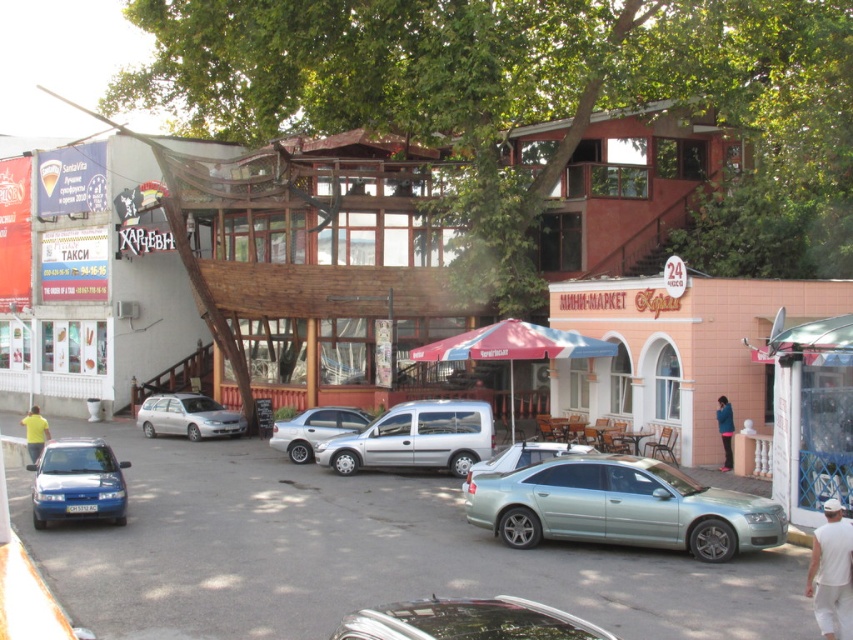
You are a pedestrian standing on the street and want to pick up the white cotton cap at lower right. Is it possible to reach the cap without moving the satin silver sedan at center?

The white cotton cap at lower right is located below the satin silver sedan at center, so it is positioned under the vehicle. Therefore, you cannot reach the cap without moving the sedan.

You are a pedestrian standing on the sidewalk in front of the two story building with a wooden balcony. You need to cross the street to reach the Santavita sign on the left. Is the silver metallic van at center blocking your path to the blue metallic hatchback at lower left?

The silver metallic van at center is above the blue metallic hatchback at lower left, so it is blocking the path to the blue metallic hatchback at lower left.

From the picture: You are a photographer standing in the middle of the street. You want to take a photo of the white cotton cap at lower right and the satin silver sedan at center. Which object should you adjust your camera to focus on first if you want to capture both in the frame without moving your position? Explain your reasoning based on their positions.

The white cotton cap at lower right is to the right of the satin silver sedan at center. Since the cap is positioned further to the right, you should focus on the satin silver sedan at center first and then pan slightly to the right to include the white cotton cap at lower right in the frame without moving your position.